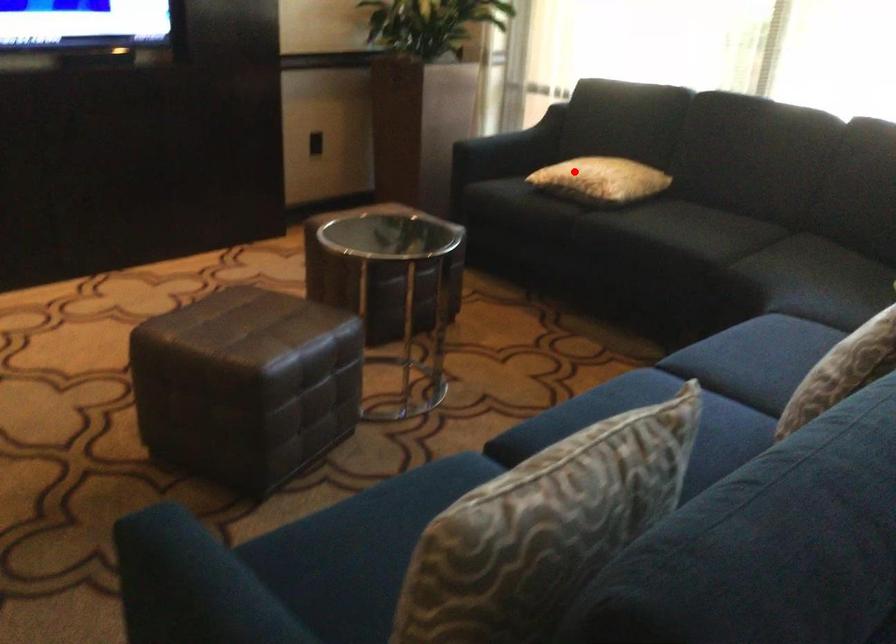
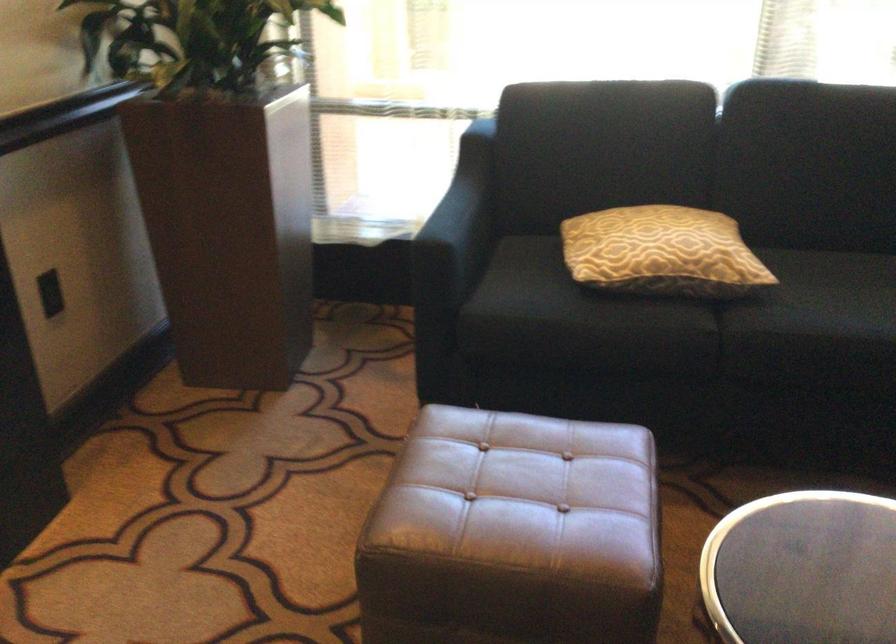
Question: I am providing you with two images of the same scene from different viewpoints. A red point is shown in image1. For the corresponding object point in image2, is it positioned nearer or farther from the camera?

Choices:
 (A) Nearer
 (B) Farther

Answer: (A)